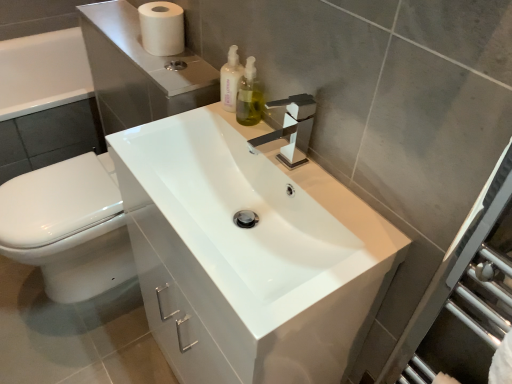
Question: Should I look upward or downward to see translucent plastic soap dispenser at upper center, the 1th soap dispenser in the left-to-right sequence?

Choices:
 (A) down
 (B) up

Answer: (B)

Question: Considering the relative sizes of translucent plastic soap dispenser at upper center, which appears as the 2th soap dispenser when viewed from the right, and white matte toilet paper at upper left in the image provided, is translucent plastic soap dispenser at upper center, which appears as the 2th soap dispenser when viewed from the right, bigger than white matte toilet paper at upper left?

Choices:
 (A) no
 (B) yes

Answer: (A)

Question: From the image's perspective, is translucent plastic soap dispenser at upper center, the 1th soap dispenser in the left-to-right sequence, on white matte toilet paper at upper left?

Choices:
 (A) yes
 (B) no

Answer: (B)

Question: Is translucent plastic soap dispenser at upper center, which appears as the 2th soap dispenser when viewed from the right, positioned with its back to white matte toilet paper at upper left?

Choices:
 (A) yes
 (B) no

Answer: (B)

Question: Is translucent plastic soap dispenser at upper center, the 1th soap dispenser in the left-to-right sequence, wider than white matte toilet paper at upper left?

Choices:
 (A) no
 (B) yes

Answer: (A)

Question: Would you say translucent plastic soap dispenser at upper center, the 1th soap dispenser in the left-to-right sequence, contains white matte toilet paper at upper left?

Choices:
 (A) no
 (B) yes

Answer: (A)

Question: Are translucent plastic soap dispenser at upper center, which appears as the 2th soap dispenser when viewed from the right, and white matte toilet paper at upper left located far from each other?

Choices:
 (A) yes
 (B) no

Answer: (B)

Question: Are green glass soap dispenser at upper center, arranged as the 2th soap dispenser when viewed from the left, and translucent plastic soap dispenser at upper center, the 1th soap dispenser in the left-to-right sequence, far apart?

Choices:
 (A) yes
 (B) no

Answer: (B)

Question: Does green glass soap dispenser at upper center, the first soap dispenser from the right, come in front of translucent plastic soap dispenser at upper center, the 1th soap dispenser in the left-to-right sequence?

Choices:
 (A) yes
 (B) no

Answer: (A)

Question: Is green glass soap dispenser at upper center, the first soap dispenser from the right, to the right of translucent plastic soap dispenser at upper center, the 1th soap dispenser in the left-to-right sequence, from the viewer's perspective?

Choices:
 (A) no
 (B) yes

Answer: (B)

Question: Considering the relative positions of green glass soap dispenser at upper center, arranged as the 2th soap dispenser when viewed from the left, and translucent plastic soap dispenser at upper center, the 1th soap dispenser in the left-to-right sequence, in the image provided, is green glass soap dispenser at upper center, arranged as the 2th soap dispenser when viewed from the left, to the left of translucent plastic soap dispenser at upper center, the 1th soap dispenser in the left-to-right sequence, from the viewer's perspective?

Choices:
 (A) no
 (B) yes

Answer: (A)

Question: Can you confirm if green glass soap dispenser at upper center, the first soap dispenser from the right, is wider than translucent plastic soap dispenser at upper center, which appears as the 2th soap dispenser when viewed from the right?

Choices:
 (A) yes
 (B) no

Answer: (A)

Question: From the image's perspective, does green glass soap dispenser at upper center, the first soap dispenser from the right, appear higher than translucent plastic soap dispenser at upper center, which appears as the 2th soap dispenser when viewed from the right?

Choices:
 (A) no
 (B) yes

Answer: (A)

Question: Is white glossy toilet at lower left behind green glass soap dispenser at upper center, the first soap dispenser from the right?

Choices:
 (A) no
 (B) yes

Answer: (B)